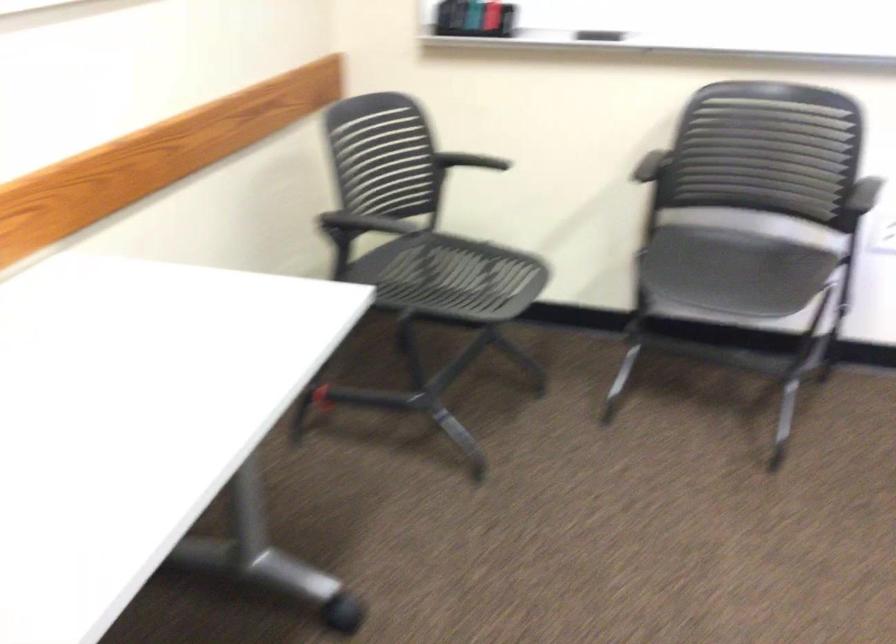
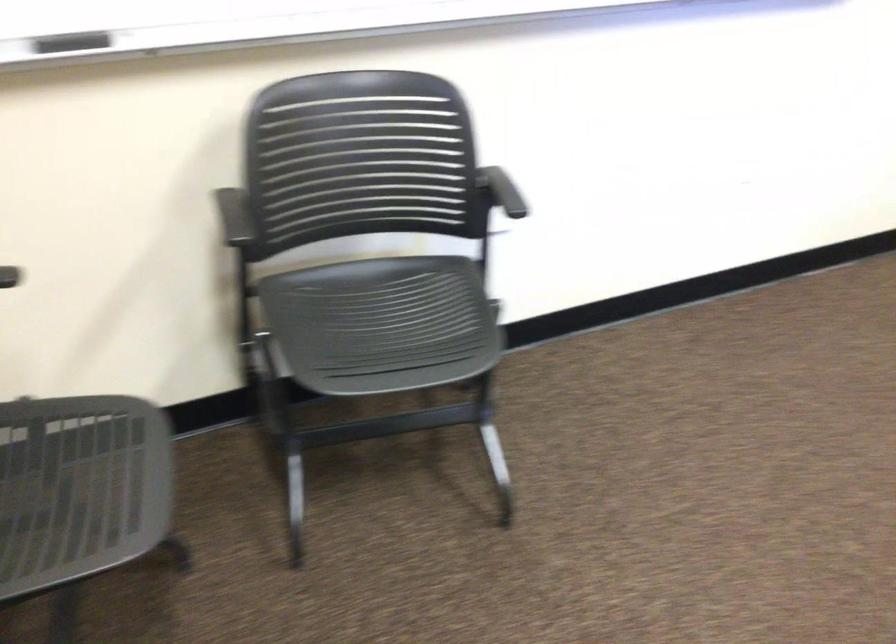
Question: Based on the continuous images, in which direction is the camera rotating? Reply with the corresponding letter.

Choices:
 (A) Left
 (B) Right
 (C) Up
 (D) Down

Answer: (B)